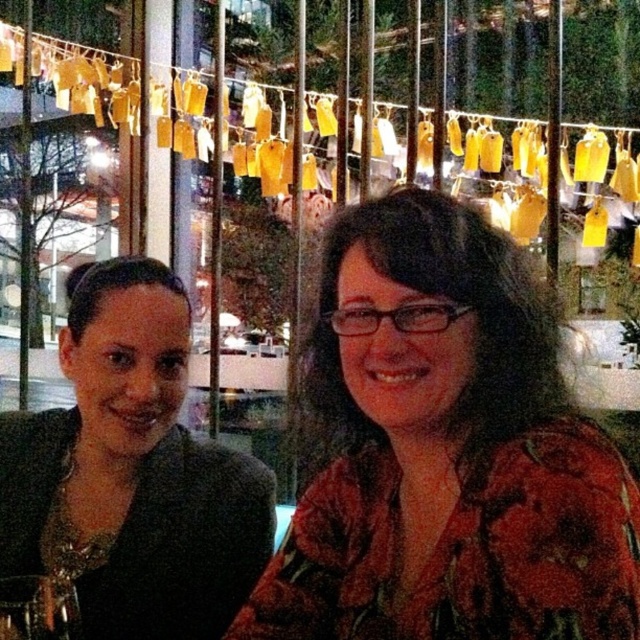
What is located at the coordinates point (445, 451)?

The floral patterned shirt at center is located at point (445, 451).